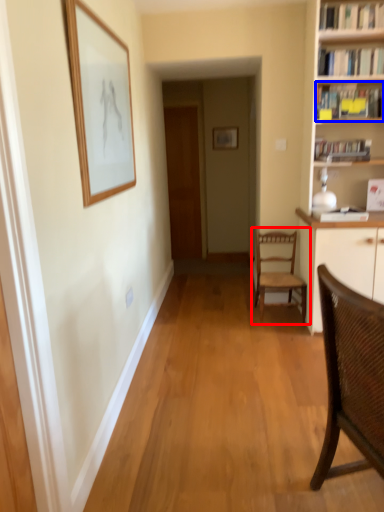
Question: Which point is further to the camera, chair (highlighted by a red box) or book (highlighted by a blue box)?

Choices:
 (A) chair
 (B) book

Answer: (A)